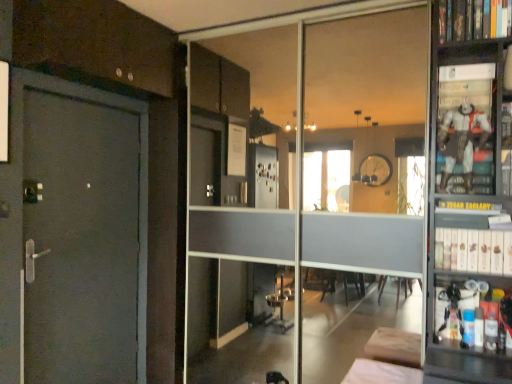
Question: From a real-world perspective, is transparent glass door at center physically below white fabric bed at lower center?

Choices:
 (A) no
 (B) yes

Answer: (A)

Question: Is transparent glass door at center further to camera compared to white fabric bed at lower center?

Choices:
 (A) no
 (B) yes

Answer: (B)

Question: From the image's perspective, is transparent glass door at center on top of white fabric bed at lower center?

Choices:
 (A) yes
 (B) no

Answer: (A)

Question: Is transparent glass door at center closer to the viewer compared to white fabric bed at lower center?

Choices:
 (A) no
 (B) yes

Answer: (A)

Question: Can we say transparent glass door at center lies outside white fabric bed at lower center?

Choices:
 (A) no
 (B) yes

Answer: (B)

Question: Can you confirm if transparent glass door at center is positioned to the right of white fabric bed at lower center?

Choices:
 (A) yes
 (B) no

Answer: (B)

Question: Does metallic figure at right have a lesser width compared to white matte bookshelf at right, which is counted as the 1th book, starting from the bottom?

Choices:
 (A) yes
 (B) no

Answer: (A)

Question: Could white matte bookshelf at right, which is counted as the 1th book, starting from the bottom, be considered to be inside metallic figure at right?

Choices:
 (A) yes
 (B) no

Answer: (B)

Question: From the image's perspective, is metallic figure at right below white matte bookshelf at right, which is counted as the 1th book, starting from the bottom?

Choices:
 (A) yes
 (B) no

Answer: (B)

Question: Is metallic figure at right closer to camera compared to white matte bookshelf at right, which is counted as the 2th book, starting from the top?

Choices:
 (A) yes
 (B) no

Answer: (B)

Question: Considering the relative positions of metallic figure at right and white matte bookshelf at right, which is counted as the 2th book, starting from the top, in the image provided, is metallic figure at right behind white matte bookshelf at right, which is counted as the 2th book, starting from the top,?

Choices:
 (A) no
 (B) yes

Answer: (B)

Question: Can you confirm if metallic figure at right is positioned to the right of white matte bookshelf at right, which is counted as the 1th book, starting from the bottom?

Choices:
 (A) yes
 (B) no

Answer: (B)

Question: Is hardcover book at upper right, the 2th book ordered from the bottom, to the left of white fabric bed at lower center from the viewer's perspective?

Choices:
 (A) no
 (B) yes

Answer: (A)